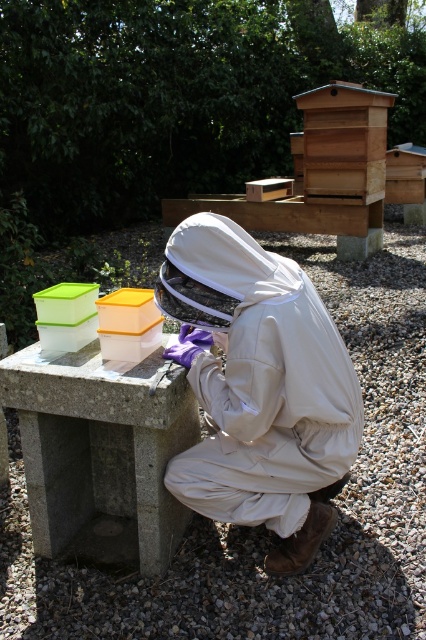
Can you confirm if white fabric beekeeper suit at center is thinner than wooden beehive at upper center?

Correct, white fabric beekeeper suit at center's width is less than wooden beehive at upper center's.

Between point (259, 472) and point (350, 134), which one is positioned behind?

Positioned behind is point (350, 134).

Is point (189, 499) closer to viewer compared to point (385, 148)?

Yes.

Where is `white fabric beekeeper suit at center`? white fabric beekeeper suit at center is located at coordinates (262, 385).

Is white fabric beekeeper suit at center below concrete table at center?

No, white fabric beekeeper suit at center is not below concrete table at center.

Is point (299, 449) less distant than point (137, 435)?

Yes, point (299, 449) is closer to viewer.

Image resolution: width=426 pixels, height=640 pixels. Identify the location of white fabric beekeeper suit at center. (262, 385).

Is point (46, 474) in front of point (351, 104)?

Yes, it is.

Between concrete table at center and wooden beehive at upper center, which one is positioned higher?

wooden beehive at upper center

Does point (187, 390) come in front of point (368, 148)?

Yes, it is.

Locate an element on the screen. This screenshot has height=640, width=426. concrete table at center is located at coordinates (100, 452).